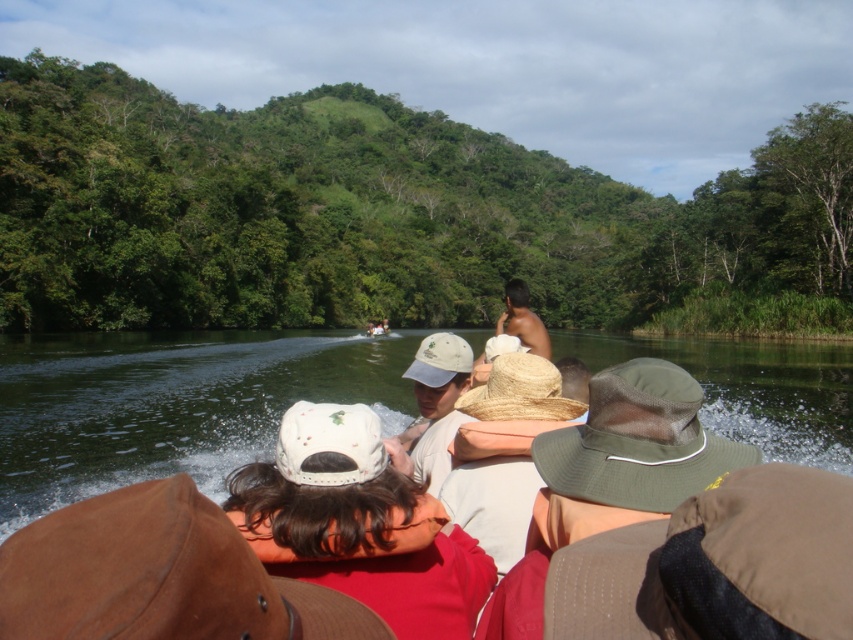
In the scene shown: Which is more to the right, green leafy hillside at upper center or white matte baseball cap at center?

white matte baseball cap at center is more to the right.

Is green leafy hillside at upper center to the left of white matte baseball cap at center from the viewer's perspective?

Indeed, green leafy hillside at upper center is positioned on the left side of white matte baseball cap at center.

Is point (503, 156) positioned behind point (393, 483)?

Yes, point (503, 156) is behind point (393, 483).

The width and height of the screenshot is (853, 640). Find the location of `green leafy hillside at upper center`. green leafy hillside at upper center is located at coordinates (374, 214).